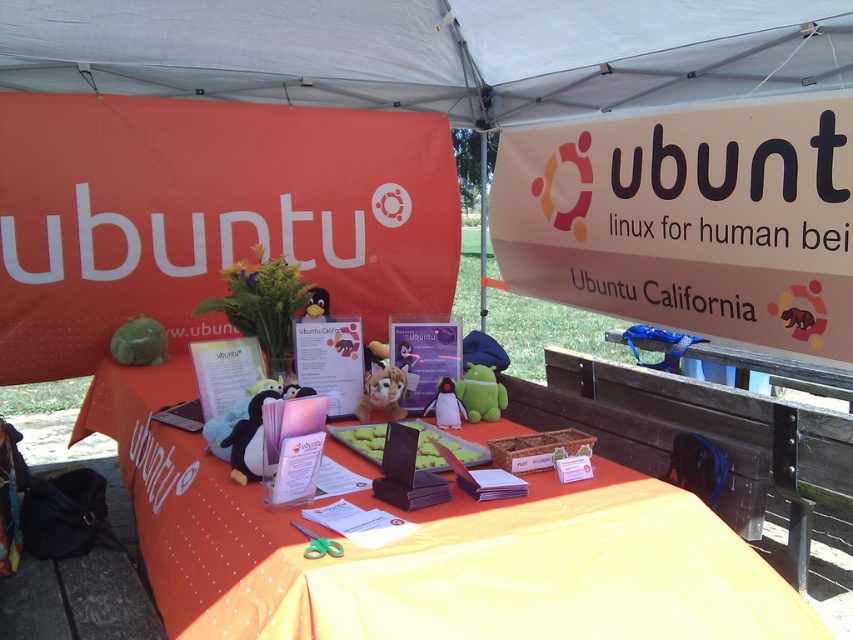
Which of these two, green plush toy at center or matte plastic penguin at center, stands shorter?

matte plastic penguin at center

Which is more to the right, green plush toy at center or matte plastic penguin at center?

Positioned to the right is green plush toy at center.

Does point (485, 410) come in front of point (457, 403)?

No, (485, 410) is further to viewer.

The width and height of the screenshot is (853, 640). What are the coordinates of `green plush toy at center` in the screenshot? It's located at (480, 394).

Is point (99, 420) positioned in front of point (383, 394)?

No, (99, 420) is further to viewer.

Describe the element at coordinates (432, 552) in the screenshot. The height and width of the screenshot is (640, 853). I see `orange fabric table at center` at that location.

Locate an element on the screen. orange fabric table at center is located at coordinates (432, 552).

Which of these two, orange fabric table at center or white paper sign at upper right, stands taller?

With more height is white paper sign at upper right.

Which is behind, point (316, 573) or point (799, 198)?

Positioned behind is point (799, 198).

In order to click on orange fabric table at center in this screenshot , I will do `click(432, 552)`.